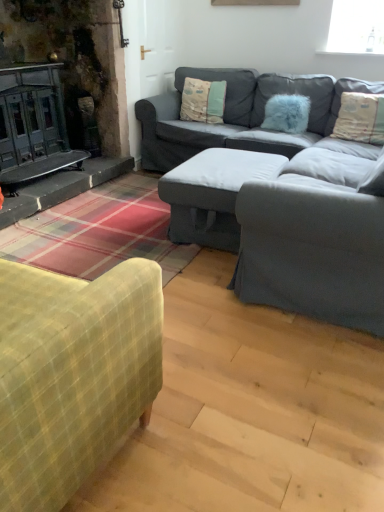
Question: Does dark gray fabric couch at center contain fluffy cream pillow at upper right, the third pillow positioned from the left?

Choices:
 (A) yes
 (B) no

Answer: (A)

Question: From the image's perspective, is dark gray fabric couch at center on top of fluffy cream pillow at upper right, which appears as the 1th pillow when viewed from the right?

Choices:
 (A) no
 (B) yes

Answer: (B)

Question: Is dark gray fabric couch at center wider than fluffy cream pillow at upper right, the third pillow positioned from the left?

Choices:
 (A) yes
 (B) no

Answer: (A)

Question: Is dark gray fabric couch at center far away from fluffy cream pillow at upper right, which appears as the 1th pillow when viewed from the right?

Choices:
 (A) yes
 (B) no

Answer: (B)

Question: Can you confirm if dark gray fabric couch at center is shorter than fluffy cream pillow at upper right, the third pillow positioned from the left?

Choices:
 (A) yes
 (B) no

Answer: (B)

Question: From a real-world perspective, relative to fluffy cream pillow at upper right, the third pillow positioned from the left, is dark gray fabric couch at center vertically above or below?

Choices:
 (A) below
 (B) above

Answer: (A)

Question: From the image's perspective, is dark gray fabric couch at center above or below fluffy cream pillow at upper right, the third pillow positioned from the left?

Choices:
 (A) below
 (B) above

Answer: (B)

Question: Is dark gray fabric couch at center taller or shorter than fluffy cream pillow at upper right, which appears as the 1th pillow when viewed from the right?

Choices:
 (A) tall
 (B) short

Answer: (A)

Question: Is dark gray fabric couch at center wider or thinner than fluffy cream pillow at upper right, the third pillow positioned from the left?

Choices:
 (A) thin
 (B) wide

Answer: (B)

Question: In terms of size, does fluffy cream pillow at upper right, which appears as the 1th pillow when viewed from the right, appear bigger or smaller than velvet green sofa at center?

Choices:
 (A) big
 (B) small

Answer: (B)

Question: Looking at their shapes, would you say fluffy cream pillow at upper right, which appears as the 1th pillow when viewed from the right, is wider or thinner than velvet green sofa at center?

Choices:
 (A) wide
 (B) thin

Answer: (B)

Question: Based on their positions, is fluffy cream pillow at upper right, which appears as the 1th pillow when viewed from the right, located to the left or right of velvet green sofa at center?

Choices:
 (A) right
 (B) left

Answer: (A)

Question: In the image, is fluffy cream pillow at upper right, the third pillow positioned from the left, positioned in front of or behind velvet green sofa at center?

Choices:
 (A) front
 (B) behind

Answer: (B)

Question: From a real-world perspective, is fluffy cream pillow at upper right, which appears as the 1th pillow when viewed from the right, positioned above or below dark gray fabric couch at center?

Choices:
 (A) below
 (B) above

Answer: (B)

Question: Considering the positions of point click(379, 133) and point click(246, 143), is point click(379, 133) closer or farther from the camera than point click(246, 143)?

Choices:
 (A) farther
 (B) closer

Answer: (A)